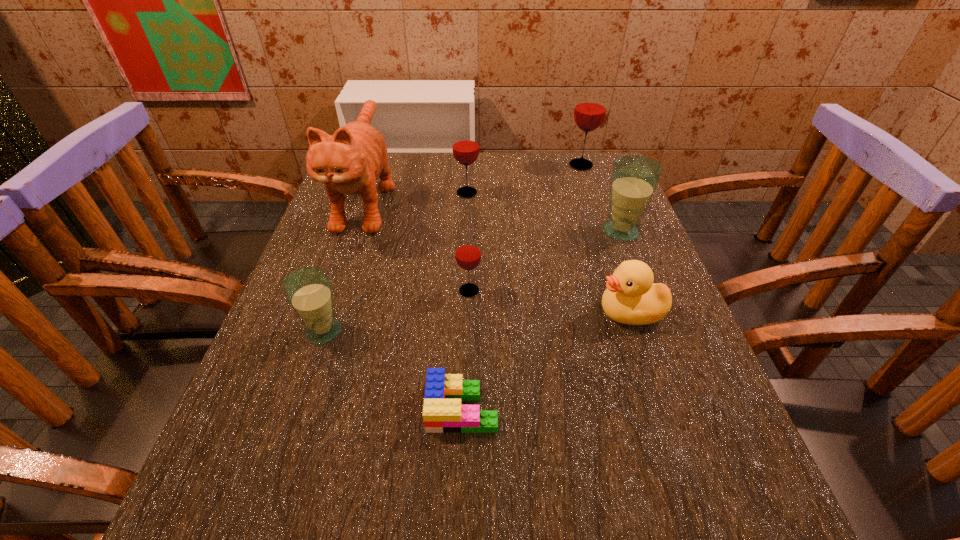
At what (x,y) coordinates should I click in order to perform the action: click on the nearer blue glass. Please return your answer as a coordinate pair (x, y). This screenshot has width=960, height=540. Looking at the image, I should click on pyautogui.click(x=308, y=290).

Locate an element on the screen. the smaller blue glass is located at coordinates (308, 290).

I want to click on yellow duck, so click(631, 298).

Locate an element on the screen. The height and width of the screenshot is (540, 960). the shortest object is located at coordinates (442, 411).

This screenshot has width=960, height=540. I want to click on green Lego, so click(442, 411).

This screenshot has width=960, height=540. I want to click on vacant space situated on the face of the ginger cat, so click(x=306, y=374).

This screenshot has width=960, height=540. Identify the location of vacant space located 0.150m on the left of the farthest red glass. (516, 165).

Where is `free space located 0.360m on the front of the second biggest red glass`? This screenshot has width=960, height=540. free space located 0.360m on the front of the second biggest red glass is located at coordinates (463, 295).

This screenshot has width=960, height=540. What are the coordinates of `vacant region located on the front of the bigger blue glass` in the screenshot? It's located at (656, 320).

Find the location of a particular element. Image resolution: width=960 pixels, height=540 pixels. vacant space located on the right of the second nearest glass is located at coordinates (576, 291).